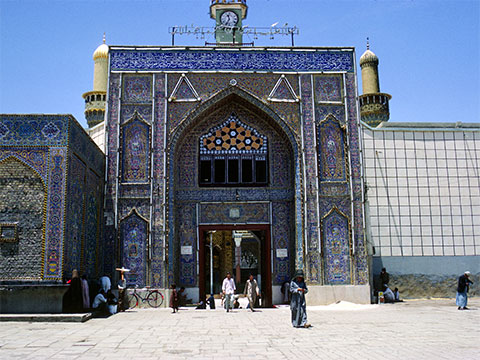
This screenshot has width=480, height=360. What are the coordinates of `doorway` in the screenshot? It's located at (252, 243).